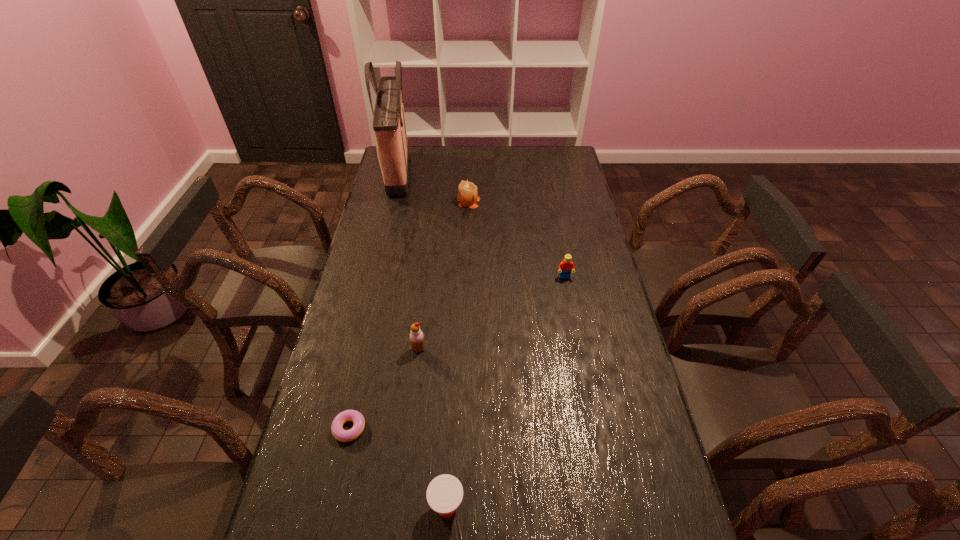
Locate an element on the screen. The height and width of the screenshot is (540, 960). object at the far left corner is located at coordinates (389, 127).

In the image, there is a desktop. Where is `vacant region at the far edge`? vacant region at the far edge is located at coordinates (494, 147).

In the image, there is a desktop. Identify the location of vacant space at the left edge. The image size is (960, 540). (367, 293).

In the image, there is a desktop. Where is `vacant space at the right edge`? vacant space at the right edge is located at coordinates (631, 366).

I want to click on vacant region at the far left corner of the desktop, so click(418, 160).

This screenshot has width=960, height=540. In order to click on free spot between the second nearest object and the candle in this screenshot , I will do `click(409, 315)`.

Where is `free space between the candle and the Lego`? free space between the candle and the Lego is located at coordinates [516, 239].

Locate an element on the screen. This screenshot has width=960, height=540. vacant region between the second shortest object and the fifth farthest object is located at coordinates (398, 467).

Where is `unoccupied area between the fifth farthest object and the Dixie cup`? The width and height of the screenshot is (960, 540). unoccupied area between the fifth farthest object and the Dixie cup is located at coordinates (398, 467).

Locate an element on the screen. The image size is (960, 540). vacant space in between the icecream and the fifth tallest object is located at coordinates (433, 428).